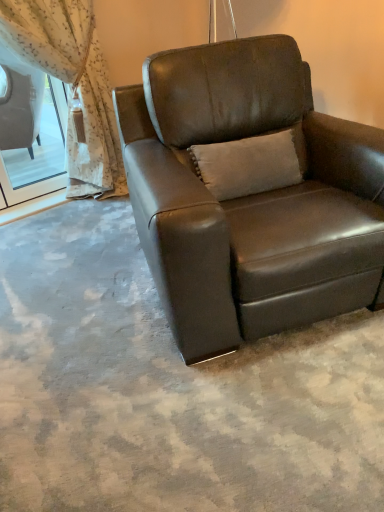
Question: Does sheer floral fabric at upper left appear on the left side of brown leather chair at center?

Choices:
 (A) no
 (B) yes

Answer: (B)

Question: Is sheer floral fabric at upper left turned away from brown leather chair at center?

Choices:
 (A) yes
 (B) no

Answer: (B)

Question: Does sheer floral fabric at upper left come in front of brown leather chair at center?

Choices:
 (A) yes
 (B) no

Answer: (B)

Question: Can brown leather chair at center be found inside sheer floral fabric at upper left?

Choices:
 (A) no
 (B) yes

Answer: (A)

Question: Considering the relative sizes of sheer floral fabric at upper left and brown leather chair at center in the image provided, is sheer floral fabric at upper left thinner than brown leather chair at center?

Choices:
 (A) yes
 (B) no

Answer: (A)

Question: Is suede beige pillow at center bigger or smaller than brown leather chair at center?

Choices:
 (A) small
 (B) big

Answer: (A)

Question: Is suede beige pillow at center inside the boundaries of brown leather chair at center, or outside?

Choices:
 (A) outside
 (B) inside

Answer: (B)

Question: In the image, is suede beige pillow at center positioned in front of or behind brown leather chair at center?

Choices:
 (A) behind
 (B) front

Answer: (A)

Question: Is point (294, 160) positioned closer to the camera than point (286, 182)?

Choices:
 (A) closer
 (B) farther

Answer: (B)

Question: Is point (221, 186) positioned closer to the camera than point (91, 116)?

Choices:
 (A) farther
 (B) closer

Answer: (B)

Question: From the image's perspective, relative to sheer floral fabric at upper left, is suede beige pillow at center above or below?

Choices:
 (A) above
 (B) below

Answer: (B)

Question: Is suede beige pillow at center taller or shorter than sheer floral fabric at upper left?

Choices:
 (A) short
 (B) tall

Answer: (A)

Question: Relative to sheer floral fabric at upper left, is suede beige pillow at center in front or behind?

Choices:
 (A) front
 (B) behind

Answer: (A)

Question: Would you say sheer floral fabric at upper left is to the left or to the right of suede beige pillow at center in the picture?

Choices:
 (A) right
 (B) left

Answer: (B)

Question: Would you say sheer floral fabric at upper left is inside or outside suede beige pillow at center?

Choices:
 (A) inside
 (B) outside

Answer: (B)